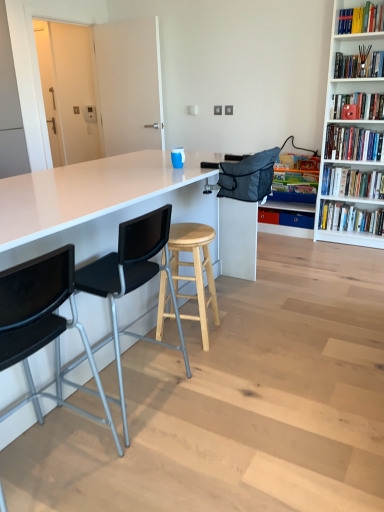
Question: Is white paperback book at upper right, which is the 2th book from bottom to top, to the left or to the right of black plastic chair at left, arranged as the second chair when viewed from the back, in the image?

Choices:
 (A) left
 (B) right

Answer: (B)

Question: Is white paperback book at upper right, placed as the 6th book when sorted from top to bottom, wider or thinner than black plastic chair at left, arranged as the second chair when viewed from the back?

Choices:
 (A) thin
 (B) wide

Answer: (A)

Question: Which is farther from the white glossy bookshelf at right, the seventh book when ordered from top to bottom?

Choices:
 (A) wooden bookshelf at upper right, acting as the sixth book starting from the bottom
 (B) hardcover book at upper right, which ranks as the 7th book in bottom-to-top order
 (C) black plastic chair at left, the second chair positioned from the front
 (D) matte red bookshelf at upper right, the 5th book when ordered from bottom to top
 (E) black fabric bag at upper right

Answer: (C)

Question: Estimate the real-world distances between objects in this image. Which object is farther from the natural wood stool at center?

Choices:
 (A) white glossy bookshelf at right, positioned as the 1th book in bottom-to-top order
 (B) wooden bookshelf at upper right, placed as the second book when sorted from top to bottom
 (C) black fabric bag at upper right
 (D) blue plastic drawer at center
 (E) black plastic chair at left, which is the first chair in front-to-back order

Answer: (B)